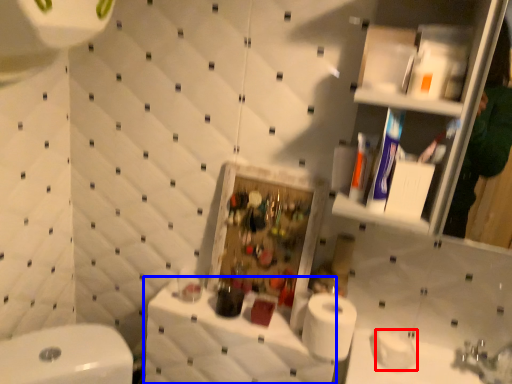
Question: Which object appears farthest to the camera in this image, toilet paper (highlighted by a red box) or counter top (highlighted by a blue box)?

Choices:
 (A) toilet paper
 (B) counter top

Answer: (A)